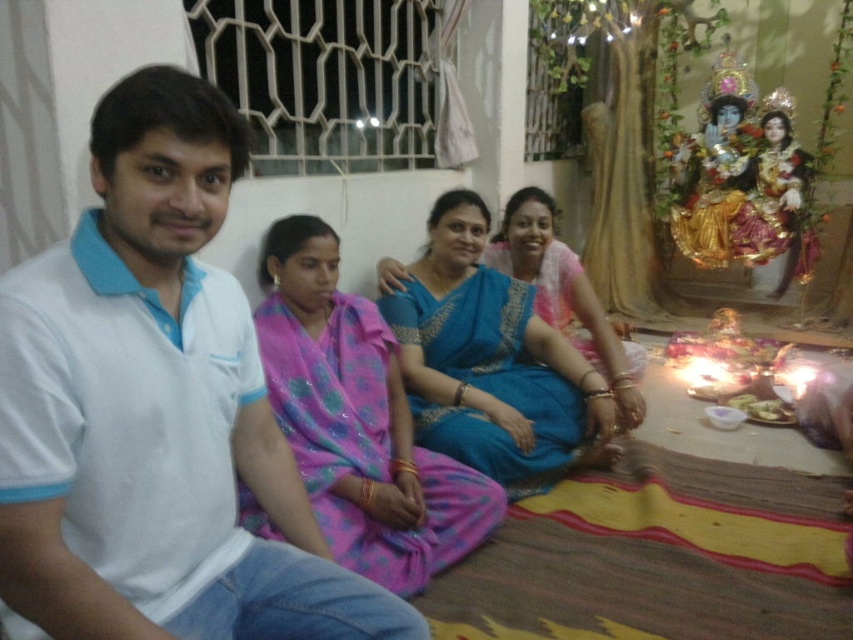
Is pink satin saree at center to the left of blue silk saree at center from the viewer's perspective?

Yes, pink satin saree at center is to the left of blue silk saree at center.

Does pink satin saree at center appear on the right side of blue silk saree at center?

Incorrect, pink satin saree at center is not on the right side of blue silk saree at center.

Who is more forward, (x=335, y=253) or (x=474, y=374)?

Positioned in front is point (x=335, y=253).

Where is `pink satin saree at center`? This screenshot has width=853, height=640. pink satin saree at center is located at coordinates (358, 420).

In the scene shown: Is white cotton shirt at left above pink satin saree at center?

Correct, white cotton shirt at left is located above pink satin saree at center.

Who is more forward, [102,323] or [241,499]?

Point [102,323] is in front.

Is point (355, 586) behind point (376, 474)?

No, it is not.

Find the location of a particular element. white cotton shirt at left is located at coordinates tap(154, 412).

Can you confirm if white cotton shirt at left is positioned above blue silk saree at center?

Incorrect, white cotton shirt at left is not positioned above blue silk saree at center.

Can you confirm if white cotton shirt at left is positioned to the left of blue silk saree at center?

Indeed, white cotton shirt at left is positioned on the left side of blue silk saree at center.

Locate an element on the screen. white cotton shirt at left is located at coordinates coord(154,412).

The width and height of the screenshot is (853, 640). What are the coordinates of `white cotton shirt at left` in the screenshot? It's located at (154, 412).